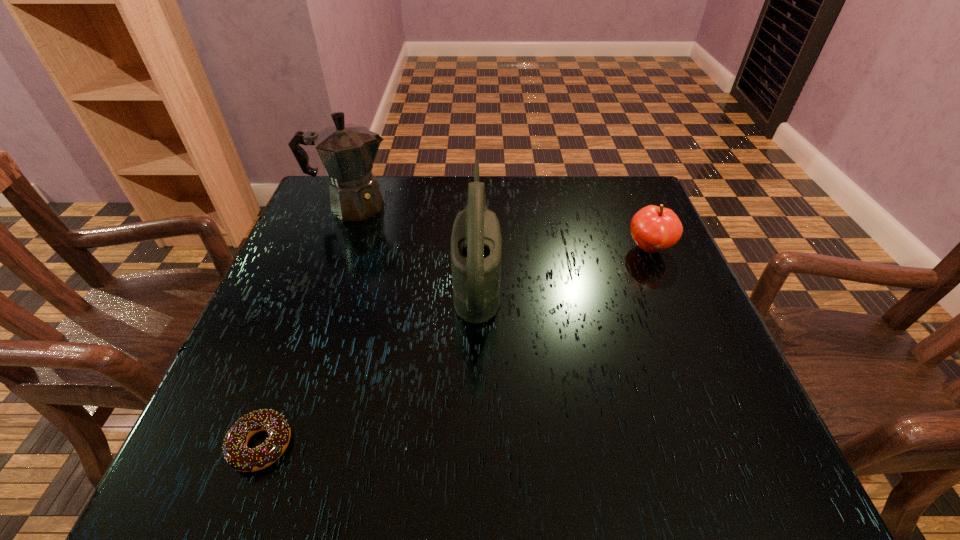
Where is `coffeepot that is positioned at the far edge`? The width and height of the screenshot is (960, 540). coffeepot that is positioned at the far edge is located at coordinates (347, 151).

Locate an element on the screen. watering can located in the far edge section of the desktop is located at coordinates (476, 243).

Find the location of a particular element. The height and width of the screenshot is (540, 960). object located at the near edge is located at coordinates (236, 453).

Where is `coffeepot that is at the left edge`? coffeepot that is at the left edge is located at coordinates (347, 151).

Locate an element on the screen. The width and height of the screenshot is (960, 540). doughnut at the left edge is located at coordinates (236, 453).

Identify the location of object that is at the right edge. (654, 229).

Find the location of a particular element. object present at the far left corner is located at coordinates (347, 151).

You are a GUI agent. You are given a task and a screenshot of the screen. Output one action in this format:
    pyautogui.click(x=<x>, y=<y>)
    Task: Click on the object that is at the near left corner
    
    Given the screenshot: What is the action you would take?
    pyautogui.click(x=236, y=453)

Find the location of a particular element. Image resolution: width=960 pixels, height=540 pixels. vacant space at the near edge of the desktop is located at coordinates (349, 437).

The height and width of the screenshot is (540, 960). I want to click on free space at the left edge of the desktop, so click(302, 275).